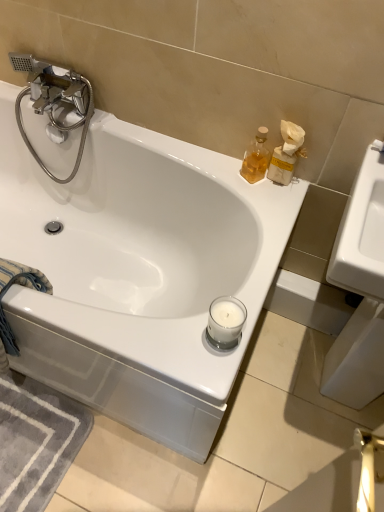
Question: From a real-world perspective, does blue cotton towel at lower left sit lower than chrome/metallic faucet at upper left?

Choices:
 (A) no
 (B) yes

Answer: (B)

Question: Considering the relative sizes of blue cotton towel at lower left and chrome/metallic faucet at upper left in the image provided, is blue cotton towel at lower left thinner than chrome/metallic faucet at upper left?

Choices:
 (A) no
 (B) yes

Answer: (A)

Question: Could you tell me if blue cotton towel at lower left is facing chrome/metallic faucet at upper left?

Choices:
 (A) yes
 (B) no

Answer: (B)

Question: From the image's perspective, is blue cotton towel at lower left on chrome/metallic faucet at upper left?

Choices:
 (A) no
 (B) yes

Answer: (A)

Question: Does blue cotton towel at lower left appear on the left side of chrome/metallic faucet at upper left?

Choices:
 (A) no
 (B) yes

Answer: (B)

Question: Is blue cotton towel at lower left far away from chrome/metallic faucet at upper left?

Choices:
 (A) no
 (B) yes

Answer: (A)

Question: Can you confirm if white glossy bathtub at upper center is taller than translucent glass soap dispenser at upper right?

Choices:
 (A) yes
 (B) no

Answer: (A)

Question: Considering the relative positions of white glossy bathtub at upper center and translucent glass soap dispenser at upper right in the image provided, is white glossy bathtub at upper center to the right of translucent glass soap dispenser at upper right from the viewer's perspective?

Choices:
 (A) no
 (B) yes

Answer: (A)

Question: Does white glossy bathtub at upper center lie in front of translucent glass soap dispenser at upper right?

Choices:
 (A) yes
 (B) no

Answer: (A)

Question: Is white glossy bathtub at upper center looking in the opposite direction of translucent glass soap dispenser at upper right?

Choices:
 (A) yes
 (B) no

Answer: (B)

Question: Is white glossy bathtub at upper center outside of translucent glass soap dispenser at upper right?

Choices:
 (A) no
 (B) yes

Answer: (B)

Question: From a real-world perspective, is white glossy bathtub at upper center positioned under translucent glass soap dispenser at upper right based on gravity?

Choices:
 (A) yes
 (B) no

Answer: (A)

Question: From a real-world perspective, does white glossy bathtub at upper center sit lower than blue cotton towel at lower left?

Choices:
 (A) yes
 (B) no

Answer: (A)